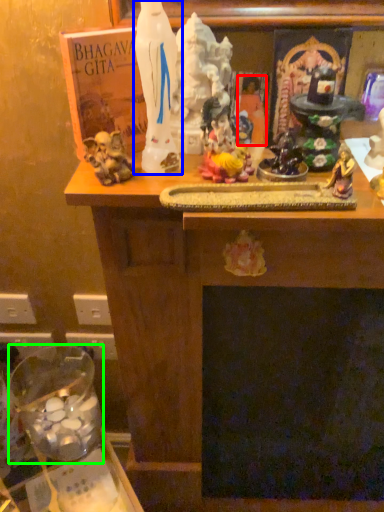
Question: Estimate the real-world distances between objects in this image. Which object is farther from person (highlighted by a red box), statue (highlighted by a blue box) or glass jar (highlighted by a green box)?

Choices:
 (A) statue
 (B) glass jar

Answer: (B)